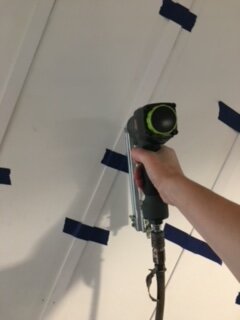
Locate an element on the screen. The width and height of the screenshot is (240, 320). cord is located at coordinates (160, 276).